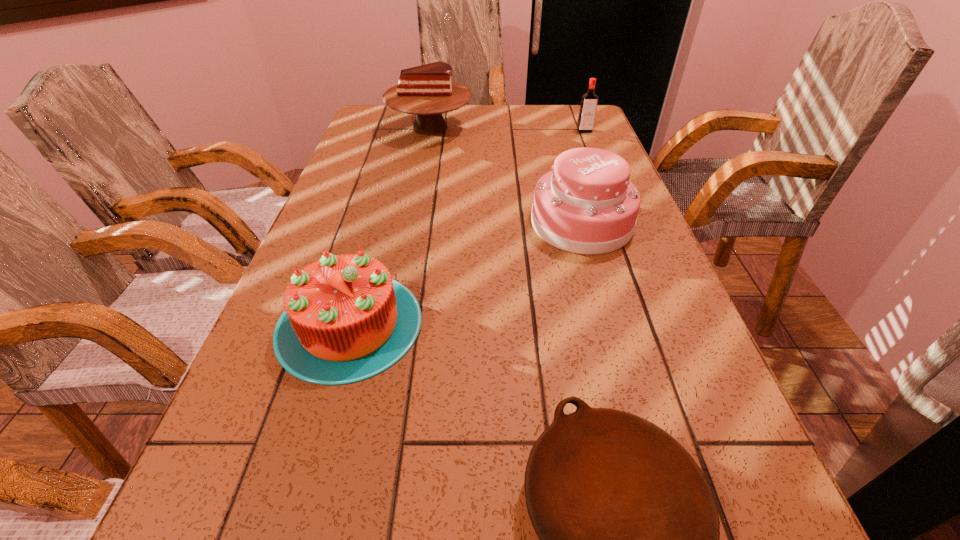
Locate an element on the screen. free space between the fourth farthest object and the third nearest object is located at coordinates (466, 273).

You are a GUI agent. You are given a task and a screenshot of the screen. Output one action in this format:
    pyautogui.click(x=<x>, y=<y>)
    Task: Click on the empty location between the farthest cake and the second nearest object
    This screenshot has width=960, height=540.
    Given the screenshot: What is the action you would take?
    390,226

Locate an element on the screen. Image resolution: width=960 pixels, height=540 pixels. free space between the nearest cake and the vodka is located at coordinates (467, 227).

Find the location of `object that is the third closest to the farthest cake`. object that is the third closest to the farthest cake is located at coordinates (345, 320).

Locate an element on the screen. Image resolution: width=960 pixels, height=540 pixels. object identified as the closest to the second farthest cake is located at coordinates (345, 320).

Identify which cake is the third closest to the vodka. Please provide its 2D coordinates. Your answer should be formatted as a tuple, i.e. [(x, y)], where the tuple contains the x and y coordinates of a point satisfying the conditions above.

[(345, 320)]

This screenshot has height=540, width=960. Identify the location of cake that stands as the second closest to the plate. (586, 205).

Locate an element on the screen. free space that satisfies the following two spatial constraints: 1. on the back side of the fourth farthest object; 2. on the left side of the second nearest cake is located at coordinates [x=378, y=223].